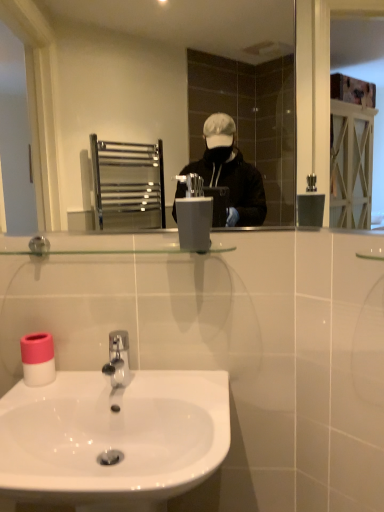
This screenshot has width=384, height=512. What do you see at coordinates (156, 89) in the screenshot? I see `metallic silver mirror at upper center` at bounding box center [156, 89].

Where is `satin grey plastic at center`? satin grey plastic at center is located at coordinates (194, 215).

Considering the relative sizes of satin grey plastic at center and white glossy sink at lower center in the image provided, is satin grey plastic at center smaller than white glossy sink at lower center?

Yes.

From the image's perspective, is satin grey plastic at center located above or below white glossy sink at lower center?

Based on their image positions, satin grey plastic at center is located above white glossy sink at lower center.

Identify the location of sink on the left of satin grey plastic at center. This screenshot has height=512, width=384. (112, 438).

Is satin grey plastic at center positioned far away from white glossy sink at lower center?

No, there isn't a large distance between satin grey plastic at center and white glossy sink at lower center.

Is white matte toilet paper at lower left in front of or behind satin grey plastic at center in the image?

In the image, white matte toilet paper at lower left appears behind satin grey plastic at center.

Where is `toilet paper below the satin grey plastic at center (from a real-world perspective)`? This screenshot has width=384, height=512. toilet paper below the satin grey plastic at center (from a real-world perspective) is located at coordinates point(38,359).

Could you tell me if white matte toilet paper at lower left is facing satin grey plastic at center?

No, white matte toilet paper at lower left does not turn towards satin grey plastic at center.

How far apart are white matte toilet paper at lower left and satin grey plastic at center?

A distance of 49.24 centimeters exists between white matte toilet paper at lower left and satin grey plastic at center.

Where is `toilet paper that is behind the white glossy sink at lower center`? Image resolution: width=384 pixels, height=512 pixels. toilet paper that is behind the white glossy sink at lower center is located at coordinates (38, 359).

Is white matte toilet paper at lower left closer to the viewer compared to white glossy sink at lower center?

No, it is behind white glossy sink at lower center.

Which point is more forward, [50,360] or [65,384]?

The point [65,384] is closer.

From a real-world perspective, which is physically above, white matte toilet paper at lower left or white glossy sink at lower center?

In real-world perspective, white matte toilet paper at lower left is above.

In the scene shown: From the image's perspective, which is above, white glossy sink at lower center or metallic silver mirror at upper center?

From the image's view, metallic silver mirror at upper center is above.

What's the angular difference between white glossy sink at lower center and metallic silver mirror at upper center's facing directions?

The facing directions of white glossy sink at lower center and metallic silver mirror at upper center are 0.215 degrees apart.

Considering the relative sizes of white glossy sink at lower center and metallic silver mirror at upper center in the image provided, is white glossy sink at lower center smaller than metallic silver mirror at upper center?

Incorrect, white glossy sink at lower center is not smaller in size than metallic silver mirror at upper center.

Considering the sizes of white glossy sink at lower center and satin grey plastic at center in the image, is white glossy sink at lower center taller or shorter than satin grey plastic at center?

Clearly, white glossy sink at lower center is taller compared to satin grey plastic at center.

From a real-world perspective, is white glossy sink at lower center above or below satin grey plastic at center?

white glossy sink at lower center is below satin grey plastic at center.

From a real-world perspective, who is located lower, white glossy sink at lower center or white matte toilet paper at lower left?

white glossy sink at lower center.

Identify the location of sink on the right side of white matte toilet paper at lower left. This screenshot has height=512, width=384. (112, 438).

Does white glossy sink at lower center come in front of white matte toilet paper at lower left?

Yes, it is in front of white matte toilet paper at lower left.

Considering the sizes of white glossy sink at lower center and white matte toilet paper at lower left in the image, is white glossy sink at lower center wider or thinner than white matte toilet paper at lower left?

Considering their sizes, white glossy sink at lower center looks broader than white matte toilet paper at lower left.

Is satin grey plastic at center in front of or behind metallic silver mirror at upper center in the image?

In the image, satin grey plastic at center appears in front of metallic silver mirror at upper center.

Considering the sizes of objects satin grey plastic at center and metallic silver mirror at upper center in the image provided, who is shorter, satin grey plastic at center or metallic silver mirror at upper center?

satin grey plastic at center.

From the image's perspective, which is below, satin grey plastic at center or metallic silver mirror at upper center?

satin grey plastic at center appears lower in the image.

From a real-world perspective, between satin grey plastic at center and metallic silver mirror at upper center, who is vertically lower?

From a 3D spatial view, satin grey plastic at center is below.

Where is `hand dryer on the right of white glossy sink at lower center`? This screenshot has height=512, width=384. hand dryer on the right of white glossy sink at lower center is located at coordinates (194, 215).

Identify the location of hand dryer that is above the white matte toilet paper at lower left (from a real-world perspective). (194, 215).

Which object lies further to the anchor point white matte toilet paper at lower left, white glossy sink at lower center or satin grey plastic at center?

Based on the image, satin grey plastic at center appears to be further to white matte toilet paper at lower left.

Based on their spatial positions, is white glossy sink at lower center or metallic silver mirror at upper center further from satin grey plastic at center?

metallic silver mirror at upper center.

Considering their positions, is satin grey plastic at center positioned further to white matte toilet paper at lower left than metallic silver mirror at upper center?

Based on the image, metallic silver mirror at upper center appears to be further to white matte toilet paper at lower left.

Looking at the image, which one is located closer to metallic silver mirror at upper center, satin grey plastic at center or white matte toilet paper at lower left?

Among the two, satin grey plastic at center is located nearer to metallic silver mirror at upper center.

Estimate the real-world distances between objects in this image. Which object is further from satin grey plastic at center, metallic silver mirror at upper center or white matte toilet paper at lower left?

The object further to satin grey plastic at center is metallic silver mirror at upper center.

Looking at the image, which one is located closer to white glossy sink at lower center, white matte toilet paper at lower left or satin grey plastic at center?

white matte toilet paper at lower left lies closer to white glossy sink at lower center than the other object.

Estimate the real-world distances between objects in this image. Which object is further from white matte toilet paper at lower left, white glossy sink at lower center or metallic silver mirror at upper center?

metallic silver mirror at upper center lies further to white matte toilet paper at lower left than the other object.

From the picture: When comparing their distances from metallic silver mirror at upper center, does white glossy sink at lower center or white matte toilet paper at lower left seem closer?

Based on the image, white glossy sink at lower center appears to be nearer to metallic silver mirror at upper center.

Where is `toilet paper between metallic silver mirror at upper center and white glossy sink at lower center from top to bottom`? This screenshot has height=512, width=384. toilet paper between metallic silver mirror at upper center and white glossy sink at lower center from top to bottom is located at coordinates (38, 359).

Locate an element on the screen. This screenshot has width=384, height=512. toilet paper that lies between satin grey plastic at center and white glossy sink at lower center from top to bottom is located at coordinates (38, 359).

Find the location of a particular element. Image resolution: width=384 pixels, height=512 pixels. hand dryer between metallic silver mirror at upper center and white matte toilet paper at lower left in the up-down direction is located at coordinates (194, 215).

At what (x,y) coordinates should I click in order to perform the action: click on hand dryer between metallic silver mirror at upper center and white glossy sink at lower center vertically. Please return your answer as a coordinate pair (x, y). The height and width of the screenshot is (512, 384). Looking at the image, I should click on (194, 215).